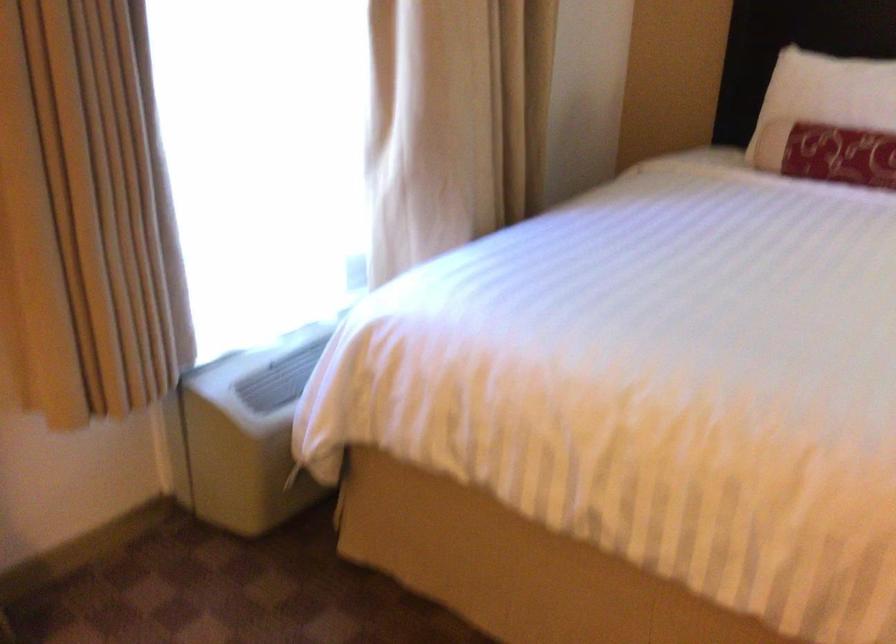
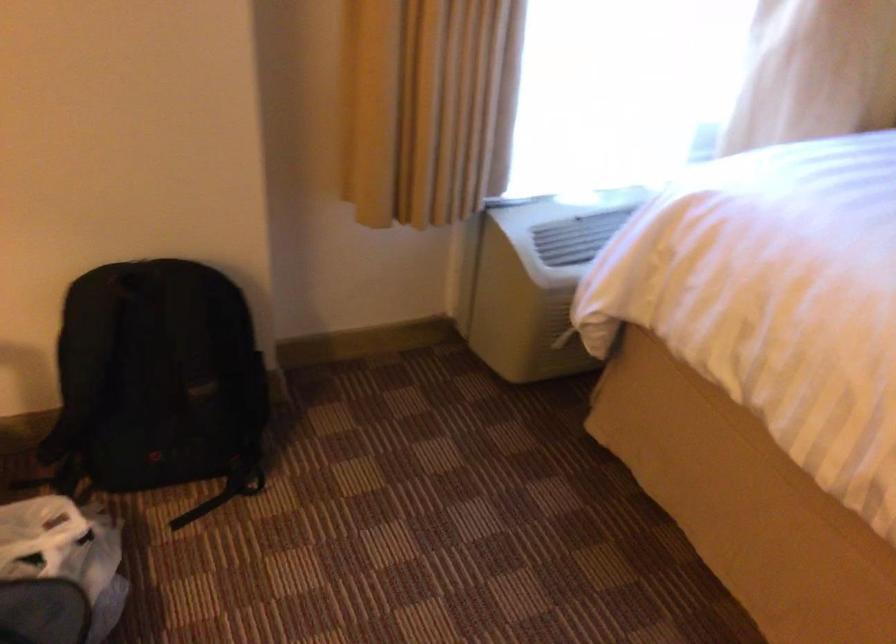
Which direction would the cameraman need to move to produce the second image?

The movement direction of the cameraman is right, forward.